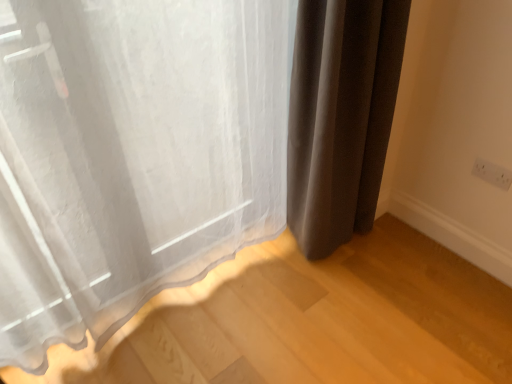
Measure the distance between dark velvet curtain at right and camera.

The distance of dark velvet curtain at right from camera is 1.31 meters.

What do you see at coordinates (341, 116) in the screenshot?
I see `dark velvet curtain at right` at bounding box center [341, 116].

What are the coordinates of `dark velvet curtain at right` in the screenshot? It's located at (341, 116).

This screenshot has width=512, height=384. Identify the location of dark velvet curtain at right. (341, 116).